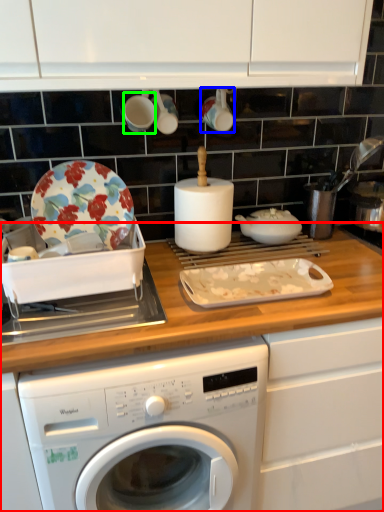
Question: Considering the real-world distances, which object is closest to countertop (highlighted by a red box)? tableware (highlighted by a blue box) or tableware (highlighted by a green box).

Choices:
 (A) tableware
 (B) tableware

Answer: (A)